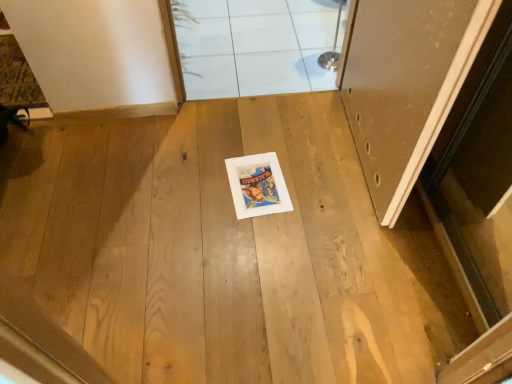
At what (x,y) coordinates should I click in order to perform the action: click on free spot below matte white door at right (from a real-world perspective). Please return your answer as a coordinate pair (x, y). The height and width of the screenshot is (384, 512). Looking at the image, I should click on (348, 152).